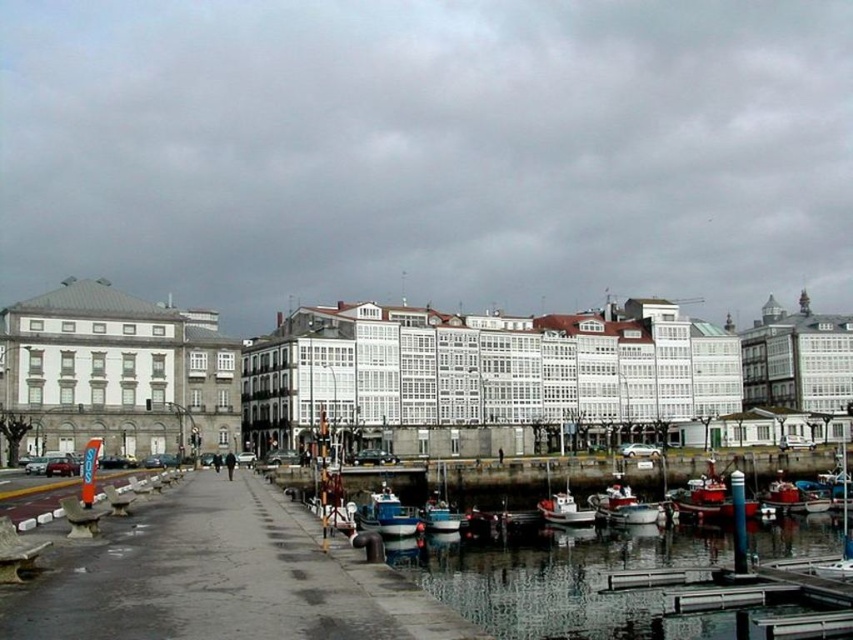
You are a tour guide leading a group near the waterfront. You need to inform your group about the distance between the blue painted wooden boat at lower center and the white plastic boat at center. What do you tell them?

The blue painted wooden boat at lower center is 14.37 meters away from the white plastic boat at center.

You are standing on the walkway and want to reach the smooth glass water at lower right. The path is clear, but you have a 2 meter long ladder you need to carry. Can you safely move the ladder horizontally without tilting it? Assume the ladder must be kept horizontal at all times.

The smooth glass water at lower right is 57.83 meters away from the viewer. Since the ladder is only 2 meters long, you can safely move it horizontally without tilting as the distance is sufficient.